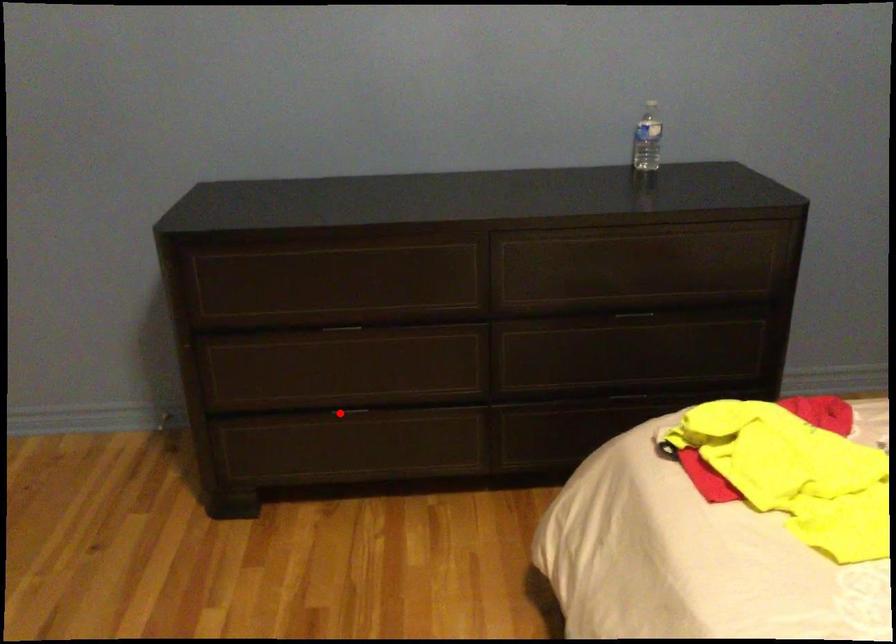
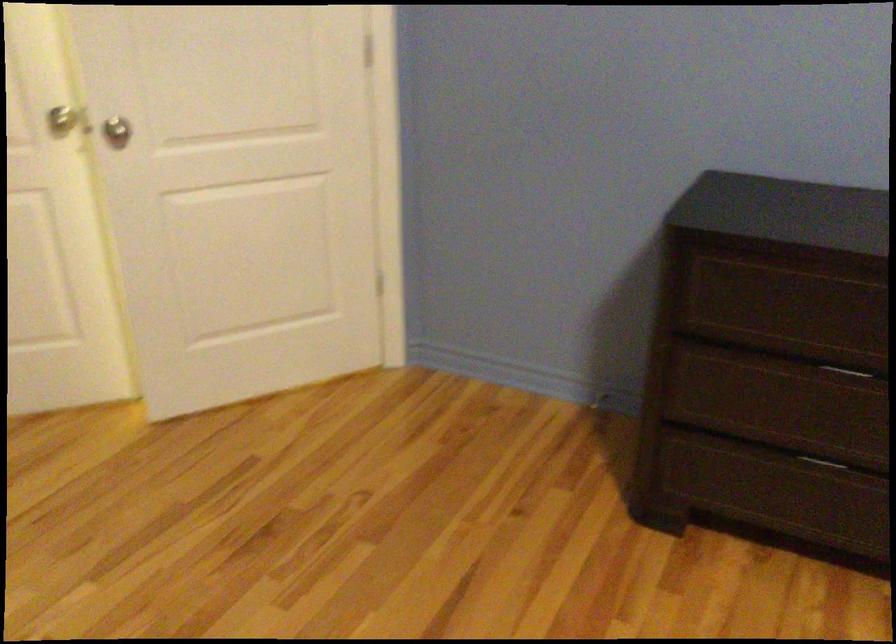
Question: I am providing you with two images of the same scene from different viewpoints. Image1 has a red point marked. In image2, the corresponding 3D location appears at what relative position? Reply with the corresponding letter.

Choices:
 (A) Closer
 (B) Farther

Answer: (A)